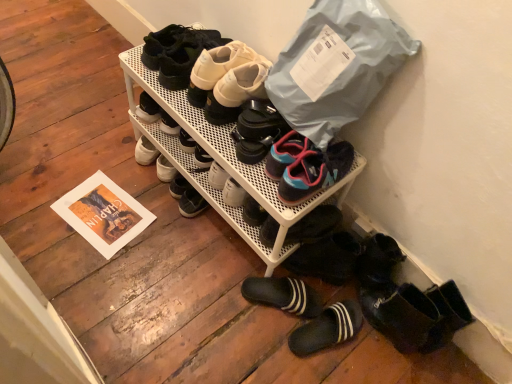
Question: Considering the relative positions of white matte sneakers at upper center, which is the seventh footwear in bottom-to-top order, and matte black shoes at upper center, marked as the first footwear in a top-to-bottom arrangement, in the image provided, is white matte sneakers at upper center, which is the seventh footwear in bottom-to-top order, to the left of matte black shoes at upper center, marked as the first footwear in a top-to-bottom arrangement, from the viewer's perspective?

Choices:
 (A) yes
 (B) no

Answer: (B)

Question: From the image's perspective, is white matte sneakers at upper center, which is the seventh footwear in bottom-to-top order, above matte black shoes at upper center, marked as the first footwear in a top-to-bottom arrangement?

Choices:
 (A) no
 (B) yes

Answer: (A)

Question: From a real-world perspective, is white matte sneakers at upper center, positioned as the 2th footwear in top-to-bottom order, physically above matte black shoes at upper center, marked as the first footwear in a top-to-bottom arrangement?

Choices:
 (A) yes
 (B) no

Answer: (A)

Question: Considering the relative positions of white matte sneakers at upper center, positioned as the 2th footwear in top-to-bottom order, and matte black shoes at upper center, acting as the eighth footwear starting from the bottom, in the image provided, is white matte sneakers at upper center, positioned as the 2th footwear in top-to-bottom order, to the right of matte black shoes at upper center, acting as the eighth footwear starting from the bottom, from the viewer's perspective?

Choices:
 (A) no
 (B) yes

Answer: (B)

Question: Is white matte sneakers at upper center, which is the seventh footwear in bottom-to-top order, not close to matte black shoes at upper center, marked as the first footwear in a top-to-bottom arrangement?

Choices:
 (A) yes
 (B) no

Answer: (B)

Question: Considering the positions of matte black shoes at upper center, acting as the eighth footwear starting from the bottom, and black rubber slipper at lower center, which appears as the seventh footwear when viewed from the top, in the image, is matte black shoes at upper center, acting as the eighth footwear starting from the bottom, taller or shorter than black rubber slipper at lower center, which appears as the seventh footwear when viewed from the top,?

Choices:
 (A) tall
 (B) short

Answer: (A)

Question: Is matte black shoes at upper center, acting as the eighth footwear starting from the bottom, situated inside black rubber slipper at lower center, which appears as the seventh footwear when viewed from the top, or outside?

Choices:
 (A) inside
 (B) outside

Answer: (B)

Question: From a real-world perspective, is matte black shoes at upper center, marked as the first footwear in a top-to-bottom arrangement, positioned above or below black rubber slipper at lower center, which appears as the seventh footwear when viewed from the top?

Choices:
 (A) below
 (B) above

Answer: (B)

Question: In the image, is matte black shoes at upper center, acting as the eighth footwear starting from the bottom, on the left side or the right side of black rubber slipper at lower center, which appears as the seventh footwear when viewed from the top?

Choices:
 (A) right
 (B) left

Answer: (B)

Question: Relative to blue mesh sneakers at center, acting as the sixth footwear starting from the top, is black rubber slippers at lower center, the 1th footwear in the bottom-to-top sequence, in front or behind?

Choices:
 (A) behind
 (B) front

Answer: (A)

Question: Is black rubber slippers at lower center, the 1th footwear in the bottom-to-top sequence, spatially inside blue mesh sneakers at center, acting as the sixth footwear starting from the top, or outside of it?

Choices:
 (A) inside
 (B) outside

Answer: (B)

Question: Looking at their shapes, would you say black rubber slippers at lower center, which is counted as the eighth footwear, starting from the top, is wider or thinner than blue mesh sneakers at center, acting as the sixth footwear starting from the top?

Choices:
 (A) thin
 (B) wide

Answer: (A)

Question: Looking at the image, does black rubber slippers at lower center, which is counted as the eighth footwear, starting from the top, seem bigger or smaller compared to blue mesh sneakers at center, acting as the sixth footwear starting from the top?

Choices:
 (A) big
 (B) small

Answer: (B)

Question: From their relative heights in the image, would you say white mesh shoe rack at center, the 5th footwear ordered from the bottom, is taller or shorter than black rubber slippers at lower center, the 1th footwear in the bottom-to-top sequence?

Choices:
 (A) short
 (B) tall

Answer: (B)

Question: Does point (217, 114) appear closer or farther from the camera than point (342, 319)?

Choices:
 (A) closer
 (B) farther

Answer: (A)